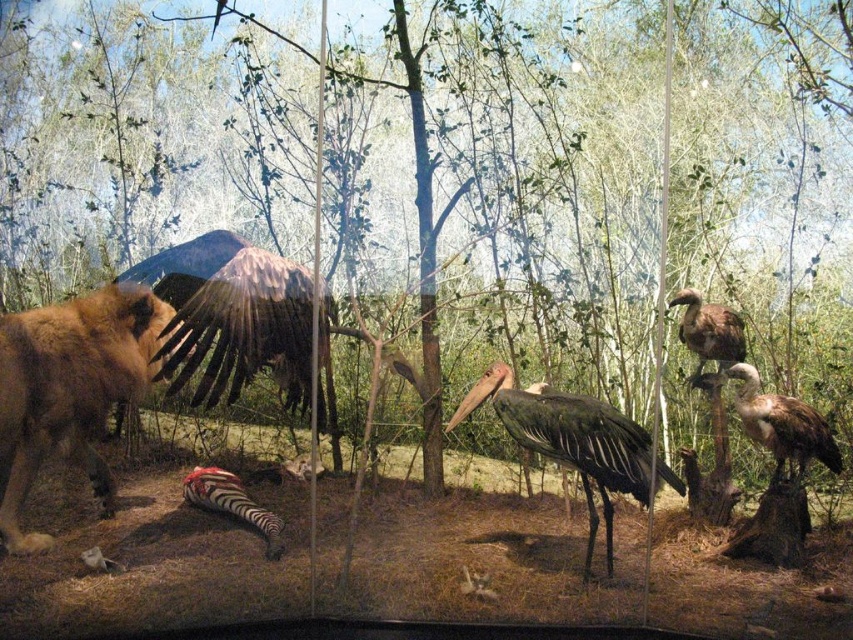
Based on the photo, which is more to the left, brown feathered vulture at center or brown feathered vulture at right?

Positioned to the left is brown feathered vulture at center.

Does brown feathered vulture at center appear under brown feathered vulture at right?

No.

At what (x,y) coordinates should I click in order to perform the action: click on brown feathered vulture at center. Please return your answer as a coordinate pair (x, y). The width and height of the screenshot is (853, 640). Looking at the image, I should click on (235, 312).

Is brown feathered vulture at center thinner than brown feathered vulture at upper right?

Incorrect, brown feathered vulture at center's width is not less than brown feathered vulture at upper right's.

What do you see at coordinates (235, 312) in the screenshot? The width and height of the screenshot is (853, 640). I see `brown feathered vulture at center` at bounding box center [235, 312].

Does point (252, 289) come closer to viewer compared to point (693, 328)?

Yes, it is.

Find the location of a particular element. brown feathered vulture at center is located at coordinates (235, 312).

What do you see at coordinates (776, 420) in the screenshot?
I see `brown feathered vulture at right` at bounding box center [776, 420].

From the picture: Which is more to the left, brown feathered vulture at right or brown feathered vulture at upper right?

From the viewer's perspective, brown feathered vulture at upper right appears more on the left side.

Between point (799, 454) and point (718, 362), which one is positioned behind?

Positioned behind is point (718, 362).

Identify the location of brown feathered vulture at right. (776, 420).